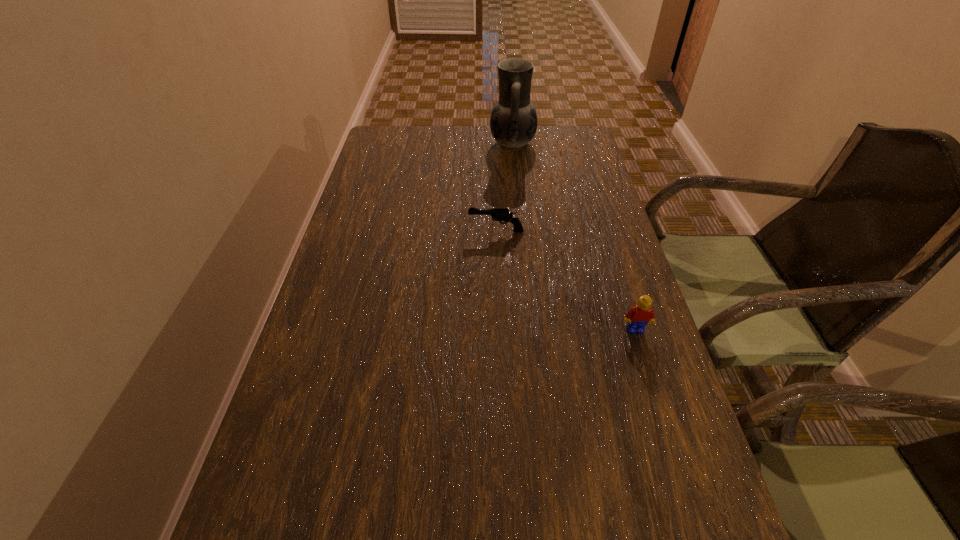
Locate an element on the screen. This screenshot has width=960, height=540. pitcher is located at coordinates (513, 123).

Identify the location of the tallest object. The image size is (960, 540). (513, 123).

Locate an element on the screen. The width and height of the screenshot is (960, 540). the second shortest object is located at coordinates pyautogui.click(x=638, y=316).

I want to click on Lego, so click(x=638, y=316).

Where is `the shortest object`? The height and width of the screenshot is (540, 960). the shortest object is located at coordinates (498, 214).

Where is `gun`? The image size is (960, 540). gun is located at coordinates (498, 214).

Locate an element on the screen. vacant region located on the front-facing side of the tallest object is located at coordinates (443, 144).

The width and height of the screenshot is (960, 540). Find the location of `vacant space situated 0.300m on the front-facing side of the tallest object`. vacant space situated 0.300m on the front-facing side of the tallest object is located at coordinates (402, 144).

Locate an element on the screen. free space located on the front-facing side of the tallest object is located at coordinates (464, 144).

The image size is (960, 540). What are the coordinates of `free space located on the front-facing side of the second shortest object` in the screenshot? It's located at (697, 528).